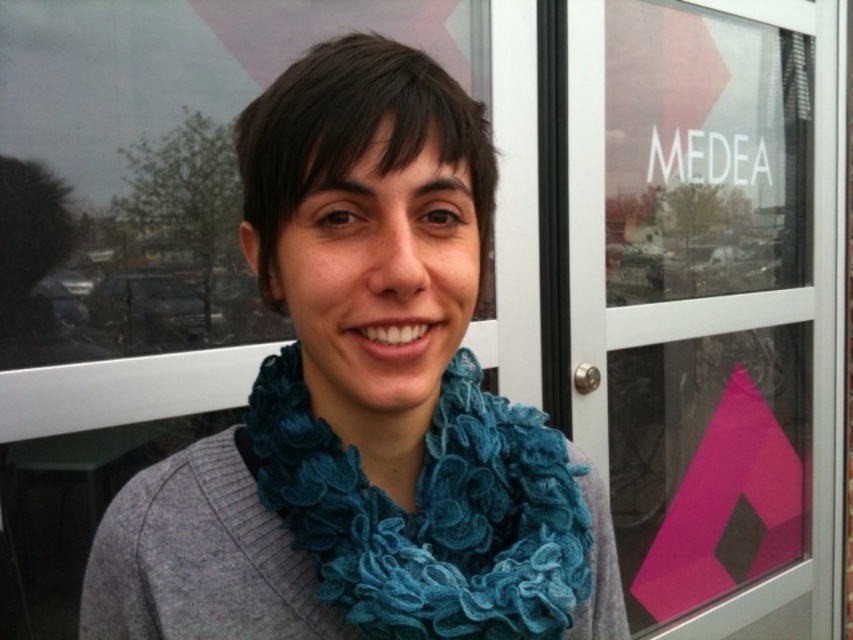
Is the position of pink matte screen door at upper center less distant than that of teal knitted scarf at center?

No, it is behind teal knitted scarf at center.

Does pink matte screen door at upper center appear on the left side of teal knitted scarf at center?

In fact, pink matte screen door at upper center is to the right of teal knitted scarf at center.

Identify the location of pink matte screen door at upper center. This screenshot has height=640, width=853. (711, 305).

Locate an element on the screen. Image resolution: width=853 pixels, height=640 pixels. pink matte screen door at upper center is located at coordinates coord(711,305).

Describe the element at coordinates (363, 403) in the screenshot. The width and height of the screenshot is (853, 640). I see `blue knitted scarf at center` at that location.

Can you confirm if blue knitted scarf at center is positioned below teal knitted scarf at center?

No, blue knitted scarf at center is not below teal knitted scarf at center.

Does point (419, 314) come farther from viewer compared to point (418, 577)?

No, it is not.

This screenshot has height=640, width=853. What are the coordinates of `blue knitted scarf at center` in the screenshot? It's located at (363, 403).

Is point (247, 467) positioned in front of point (639, 556)?

Yes, it is in front of point (639, 556).

Where is `blue knitted scarf at center`? blue knitted scarf at center is located at coordinates (363, 403).